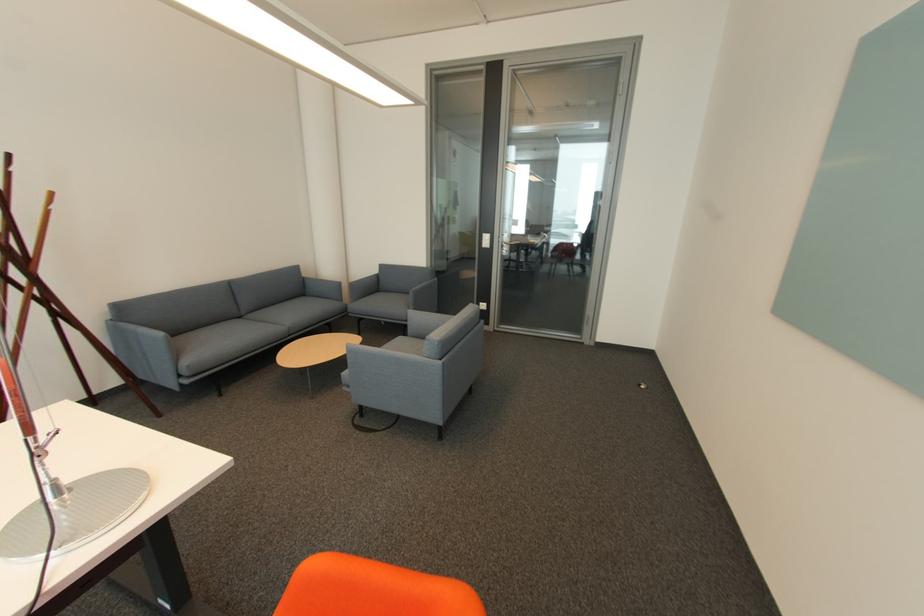
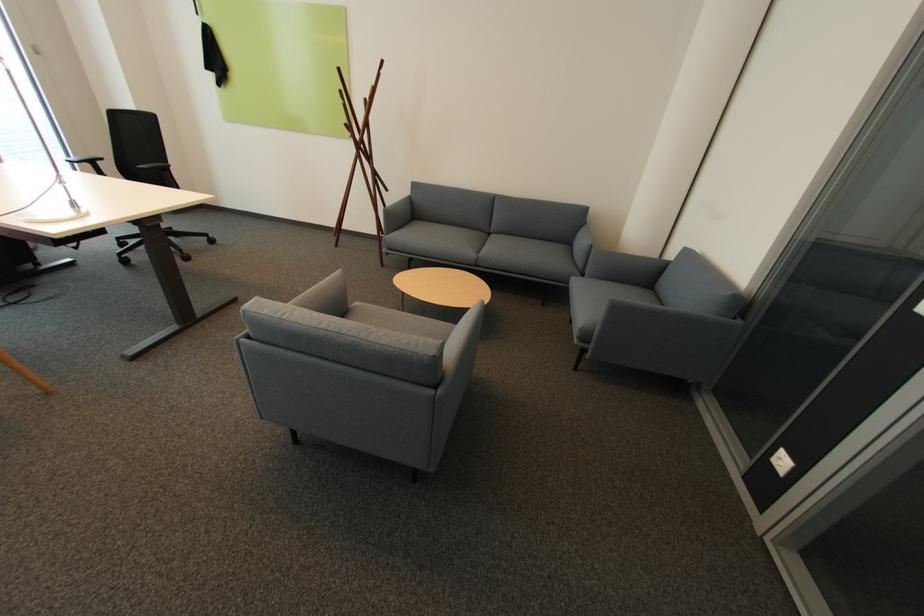
Where in the second image is the point corresponding to (296,334) from the first image?

(482, 265)